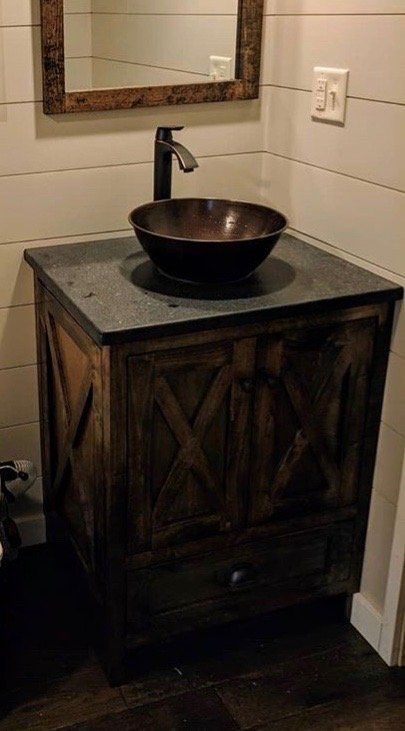
Locate an element on the screen. floor is located at coordinates [x=361, y=648], [x=369, y=699], [x=266, y=712], [x=280, y=670], [x=214, y=670], [x=94, y=681], [x=60, y=666], [x=8, y=697], [x=83, y=724], [x=140, y=710].